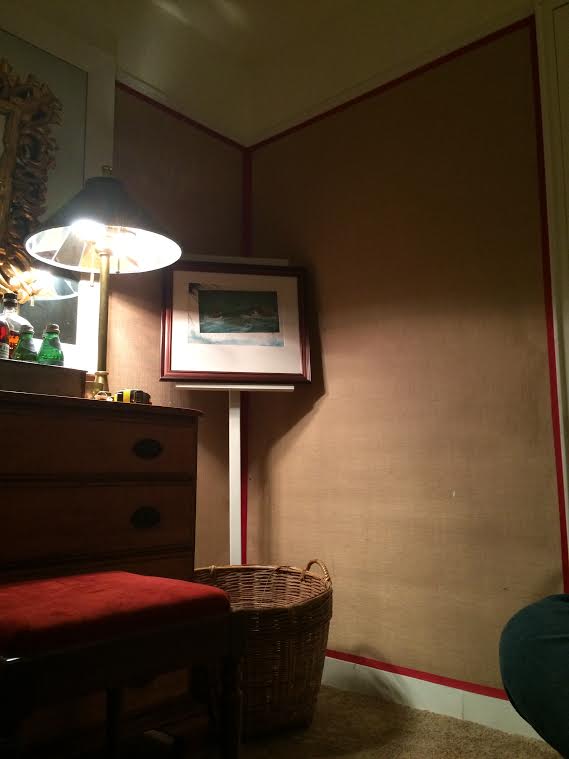
This screenshot has height=759, width=569. I want to click on red ottoman, so click(x=129, y=584).